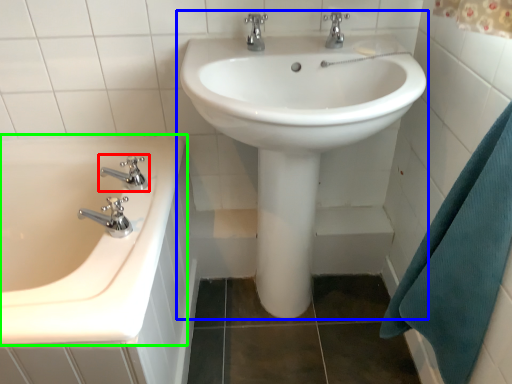
Question: Which object is positioned farthest from tap (highlighted by a red box)? Select from sink (highlighted by a blue box) and bathtub (highlighted by a green box).

Choices:
 (A) sink
 (B) bathtub

Answer: (A)